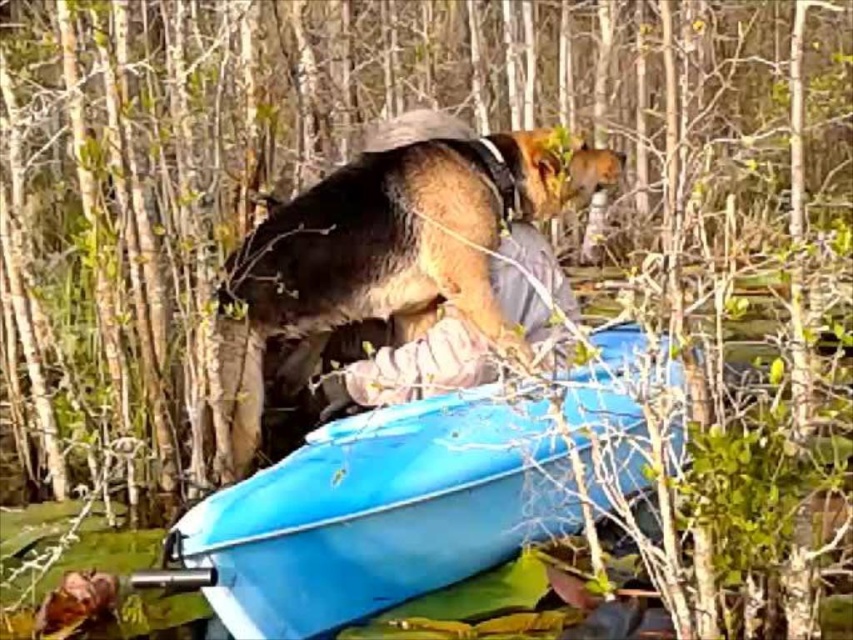
Is point (512, 492) closer to camera compared to point (321, 186)?

Yes, it is in front of point (321, 186).

Can you confirm if blue plastic boat at center is taller than brown fur dog at center?

In fact, blue plastic boat at center may be shorter than brown fur dog at center.

Which is behind, point (636, 388) or point (252, 266)?

The point (252, 266) is more distant.

Identify the location of blue plastic boat at center. Image resolution: width=853 pixels, height=640 pixels. (380, 513).